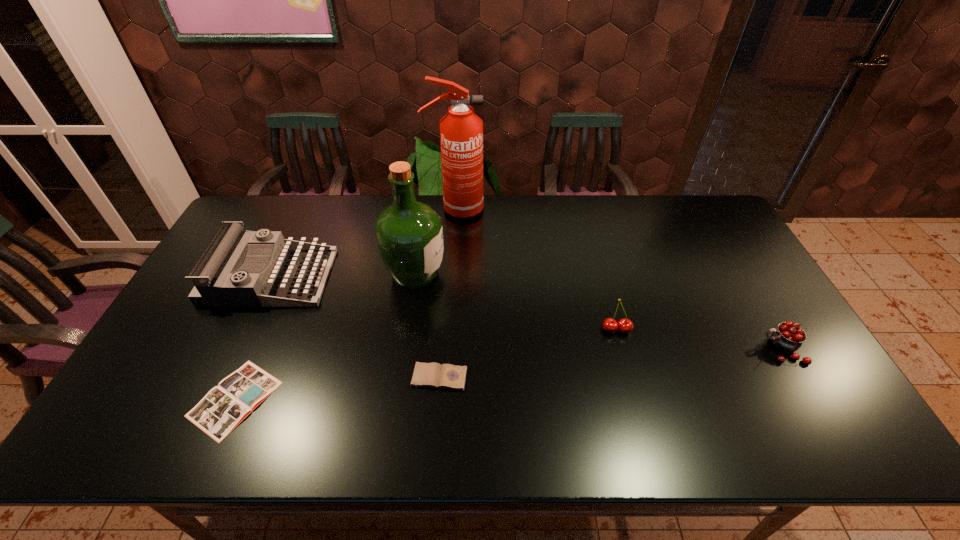
Locate an element on the screen. This screenshot has width=960, height=540. free location located 0.380m on the typing side of the typewriter is located at coordinates (451, 276).

Locate an element on the screen. The width and height of the screenshot is (960, 540). blank space located 0.080m with the stems of the second object from right to left pointing upwards is located at coordinates [625, 361].

You are a GUI agent. You are given a task and a screenshot of the screen. Output one action in this format:
    pyautogui.click(x=<x>, y=<y>)
    Task: Click on the free location located on the handle side of the rightmost object
    The height and width of the screenshot is (540, 960).
    Given the screenshot: What is the action you would take?
    pyautogui.click(x=676, y=349)

Identify the location of vacant position located on the handle side of the rightmost object. pyautogui.click(x=740, y=349).

Find the location of `vacant area situated on the handle side of the rightmost object`. vacant area situated on the handle side of the rightmost object is located at coordinates (x=695, y=349).

Identify the location of free space located 0.070m on the front of the diary. The height and width of the screenshot is (540, 960). (437, 417).

This screenshot has width=960, height=540. What are the coordinates of `free spot located 0.160m on the left of the book` in the screenshot? It's located at (127, 399).

This screenshot has width=960, height=540. Find the location of `object at the far edge`. object at the far edge is located at coordinates (461, 131).

Find the location of `object at the near edge`. object at the near edge is located at coordinates (224, 407).

Where is `typewriter located at the left edge`? typewriter located at the left edge is located at coordinates (215, 285).